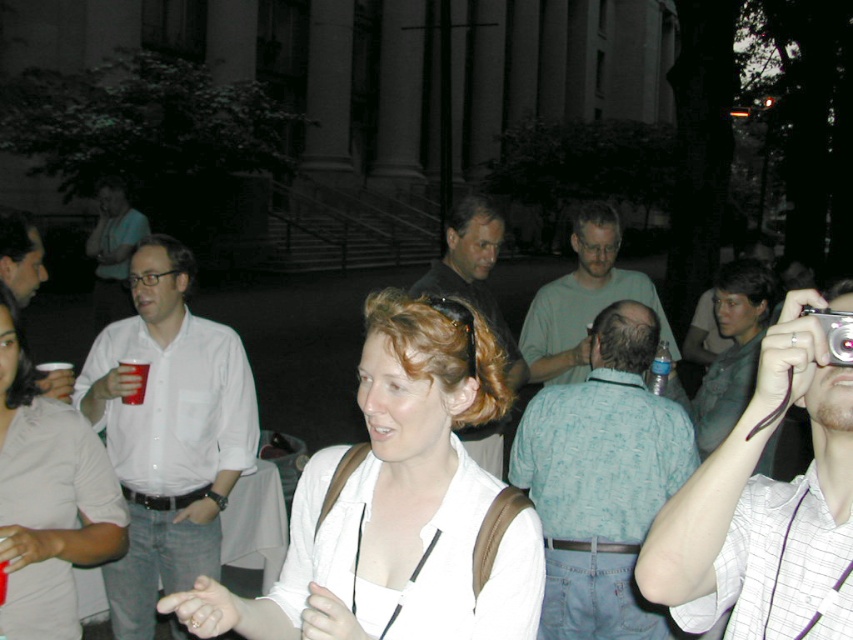
You are at a party and want to grab a drink from the red plastic cup at center left without accidentally touching the matte green shirt at center. Given their sizes, is this possible?

The matte green shirt at center is larger in size than the red plastic cup at center left. Since the shirt is bigger, there should be enough space to reach the cup without touching the shirt.

You are at a social gathering and want to grab a drink from the red plastic cup at center left without disturbing the woman in the white shirt at center. Can you reach the cup without moving her?

The white shirt at center is to the left of the red plastic cup at center left, so you can reach the red plastic cup at center left without moving the woman in the white shirt at center as they are positioned apart in the scene.